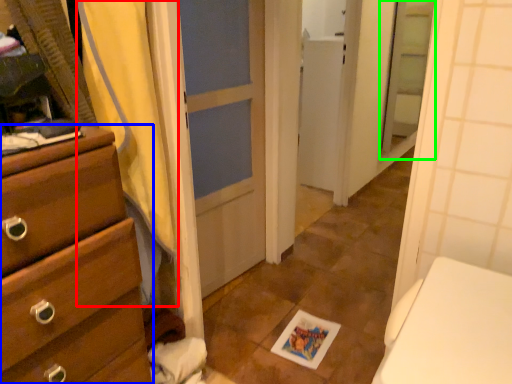
Question: Considering the real-world distances, which object is farthest from shower curtain (highlighted by a red box)? chest of drawers (highlighted by a blue box) or screen door (highlighted by a green box)?

Choices:
 (A) chest of drawers
 (B) screen door

Answer: (B)